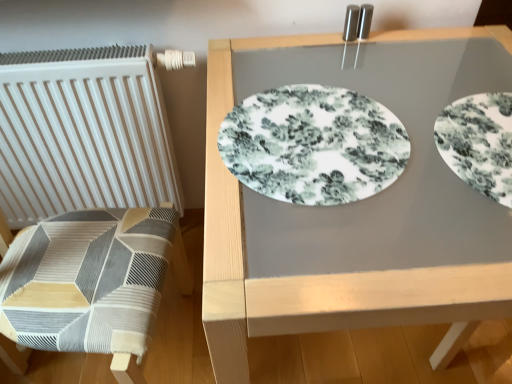
Question: In terms of height, does white floral plate at upper right, marked as the second plate in a left-to-right arrangement, look taller or shorter compared to white glossy placemat at center?

Choices:
 (A) tall
 (B) short

Answer: (B)

Question: From the image's perspective, relative to white glossy placemat at center, is white floral plate at upper right, marked as the second plate in a left-to-right arrangement, above or below?

Choices:
 (A) below
 (B) above

Answer: (B)

Question: Which object is positioned closest to the white glossy placemat at center?

Choices:
 (A) white floral plate at center, the 2th plate in the right-to-left sequence
 (B) white floral plate at upper right, placed as the first plate when sorted from right to left
 (C) white matte radiator at left

Answer: (A)

Question: Which object is positioned closest to the white glossy placemat at center?

Choices:
 (A) white floral plate at upper right, marked as the second plate in a left-to-right arrangement
 (B) white floral plate at center, the 2th plate in the right-to-left sequence
 (C) white matte radiator at left

Answer: (B)